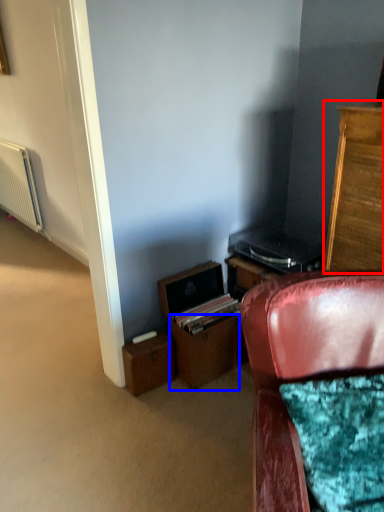
Question: Which of the following is the farthest to the observer, cabinetry (highlighted by a red box) or drawer (highlighted by a blue box)?

Choices:
 (A) cabinetry
 (B) drawer

Answer: (B)